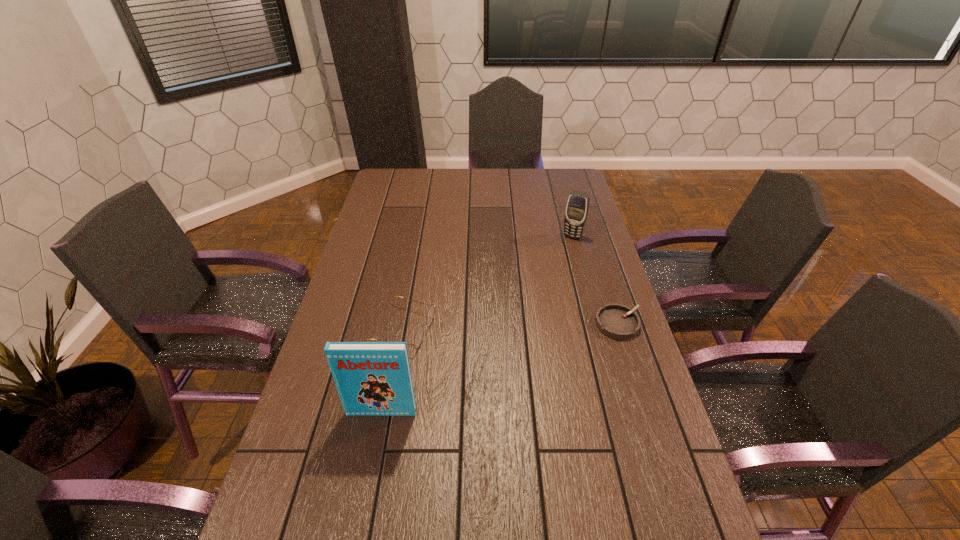
You are a GUI agent. You are given a task and a screenshot of the screen. Output one action in this format:
    pyautogui.click(x=<x>, y=<y>)
    Task: Click on the object that is the closest to the spectacles
    
    Given the screenshot: What is the action you would take?
    pyautogui.click(x=372, y=378)

This screenshot has height=540, width=960. I want to click on free space that satisfies the following two spatial constraints: 1. on the back side of the spectacles; 2. on the right side of the shortest object, so click(402, 323).

You are a GUI agent. You are given a task and a screenshot of the screen. Output one action in this format:
    pyautogui.click(x=<x>, y=<y>)
    Task: Click on the free location that satisfies the following two spatial constraints: 1. on the front side of the shortest object; 2. on the left side of the cellular telephone
    This screenshot has height=540, width=960.
    Given the screenshot: What is the action you would take?
    pyautogui.click(x=596, y=323)